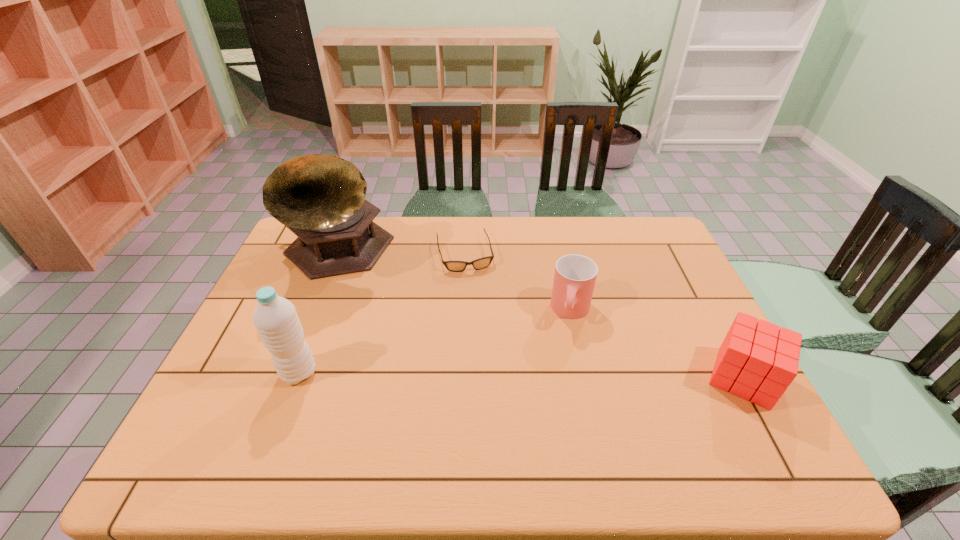
At what (x,y) coordinates should I click in order to perform the action: click on unoccupied position between the water bottle and the sunglasses. Please return your answer as a coordinate pair (x, y). Image resolution: width=960 pixels, height=540 pixels. Looking at the image, I should click on (382, 313).

At what (x,y) coordinates should I click in order to perform the action: click on object that is the third closest to the rightmost object. Please return your answer as a coordinate pair (x, y). Image resolution: width=960 pixels, height=540 pixels. Looking at the image, I should click on (321, 198).

Locate which object ranks second in proximity to the sunglasses. Please provide its 2D coordinates. Your answer should be formatted as a tuple, i.e. [(x, y)], where the tuple contains the x and y coordinates of a point satisfying the conditions above.

[(575, 275)]

Locate an element on the screen. The image size is (960, 540). free region that satisfies the following two spatial constraints: 1. on the back side of the third object from left to right; 2. on the right side of the tallest object is located at coordinates [x=337, y=254].

Identify the location of vacant region that satisfies the following two spatial constraints: 1. on the front side of the fourth object from left to right; 2. on the right side of the tallest object. (314, 312).